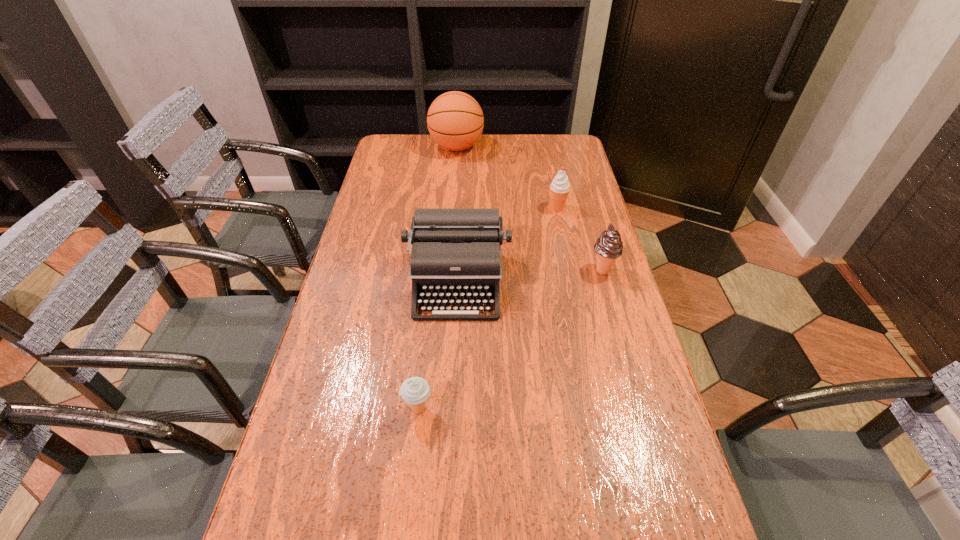
Locate an element on the screen. This screenshot has width=960, height=540. the farthest object is located at coordinates (455, 121).

You are a GUI agent. You are given a task and a screenshot of the screen. Output one action in this format:
    pyautogui.click(x=<x>, y=<y>)
    Task: Click on the tallest object
    The width and height of the screenshot is (960, 540).
    Given the screenshot: What is the action you would take?
    pyautogui.click(x=455, y=121)

Where is `typewriter`? Image resolution: width=960 pixels, height=540 pixels. typewriter is located at coordinates [455, 252].

In order to click on the rightmost icecream in this screenshot , I will do `click(608, 247)`.

Identify the location of the second farthest icecream. The image size is (960, 540). (608, 247).

Locate an element on the screen. This screenshot has width=960, height=540. the second icecream from left to right is located at coordinates (559, 188).

Find the location of a particular element. the second object from right to left is located at coordinates (559, 188).

What are the coordinates of `the leftmost icecream` in the screenshot? It's located at (415, 391).

The image size is (960, 540). I want to click on the shortest object, so click(415, 391).

Identify the location of vacant space located on the front of the basketball. Image resolution: width=960 pixels, height=540 pixels. (452, 204).